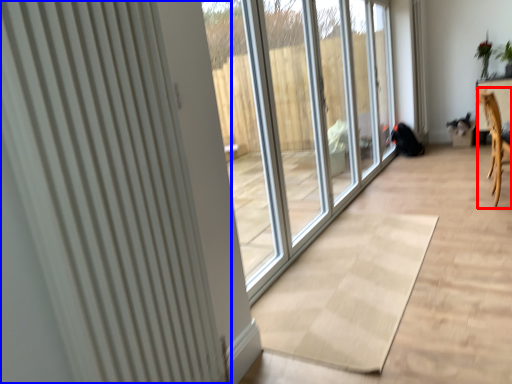
Question: Which point is closer to the camera, armchair (highlighted by a red box) or radiator (highlighted by a blue box)?

Choices:
 (A) armchair
 (B) radiator

Answer: (B)